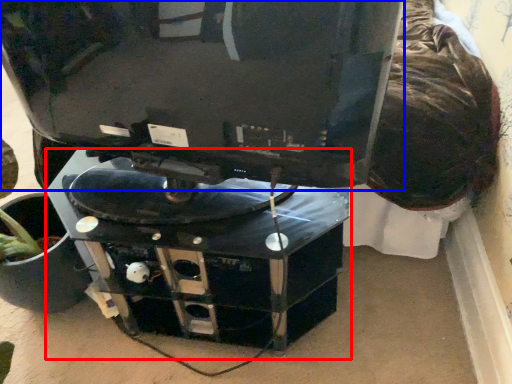
Question: Among these objects, which one is nearest to the camera, computer desk (highlighted by a red box) or computer monitor (highlighted by a blue box)?

Choices:
 (A) computer desk
 (B) computer monitor

Answer: (B)